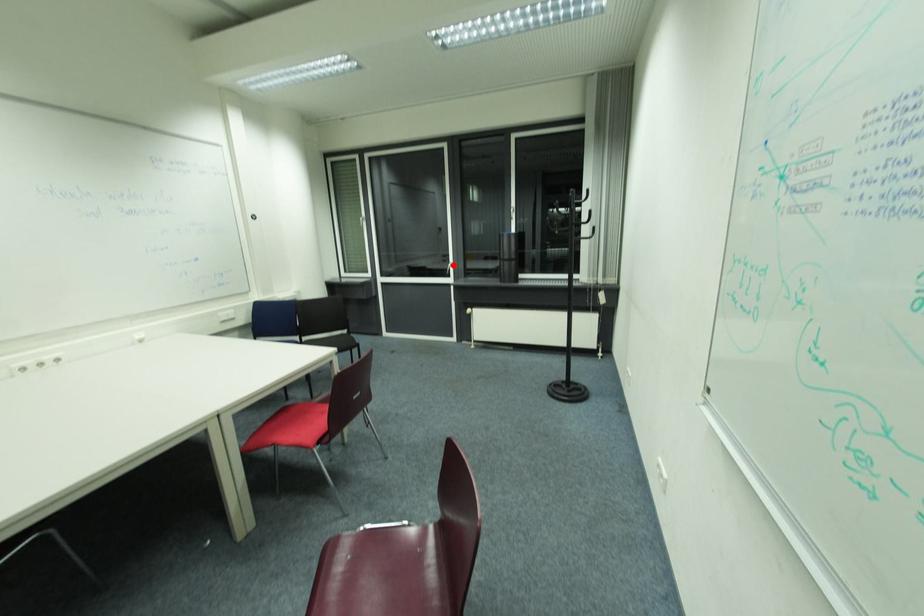
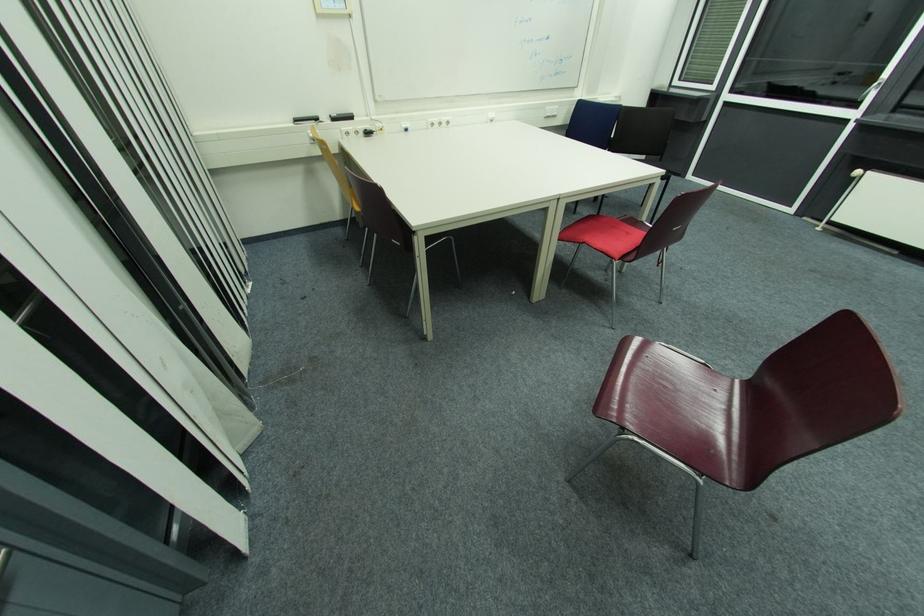
Question: I am providing you with two images of the same scene from different viewpoints. In image1, a red point is highlighted. Considering the same 3D point in image2, which of the following is correct?

Choices:
 (A) It is closer
 (B) It is farther

Answer: (B)